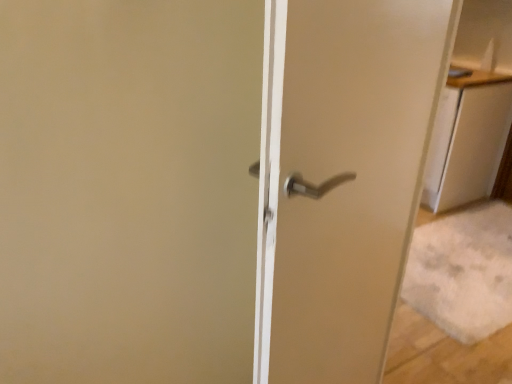
The image size is (512, 384). What do you see at coordinates (342, 173) in the screenshot? I see `satin silver handle at center` at bounding box center [342, 173].

You are a GUI agent. You are given a task and a screenshot of the screen. Output one action in this format:
    pyautogui.click(x=<x>, y=<y>)
    Task: Click on the satin silver handle at center
    The image size is (512, 384).
    Given the screenshot: What is the action you would take?
    pyautogui.click(x=342, y=173)

What do you see at coordinates (467, 139) in the screenshot?
I see `white glossy cabinet at upper right` at bounding box center [467, 139].

Find the location of a particular element. white glossy cabinet at upper right is located at coordinates click(467, 139).

Find the location of a particular element. Image resolution: width=512 pixels, height=384 pixels. satin silver handle at center is located at coordinates (342, 173).

Considering the positions of objects satin silver handle at center and white glossy cabinet at upper right in the image provided, who is more to the right, satin silver handle at center or white glossy cabinet at upper right?

From the viewer's perspective, white glossy cabinet at upper right appears more on the right side.

Does satin silver handle at center lie in front of white glossy cabinet at upper right?

Yes, the depth of satin silver handle at center is less than that of white glossy cabinet at upper right.

Which point is more forward, (382, 4) or (453, 165)?

Positioned in front is point (382, 4).

From the image's perspective, is satin silver handle at center located above white glossy cabinet at upper right?

No, from the image's perspective, satin silver handle at center is not on top of white glossy cabinet at upper right.

From a real-world perspective, is satin silver handle at center physically above white glossy cabinet at upper right?

Yes, from a real-world perspective, satin silver handle at center is on top of white glossy cabinet at upper right.

Which of these two, satin silver handle at center or white glossy cabinet at upper right, is thinner?

satin silver handle at center.

Is satin silver handle at center taller than white glossy cabinet at upper right?

Indeed, satin silver handle at center has a greater height compared to white glossy cabinet at upper right.

Based on the photo, who is bigger, satin silver handle at center or white glossy cabinet at upper right?

With larger size is satin silver handle at center.

Is satin silver handle at center not inside white glossy cabinet at upper right?

satin silver handle at center lies outside white glossy cabinet at upper right's area.

Would you say satin silver handle at center is a long distance from white glossy cabinet at upper right?

Yes, satin silver handle at center and white glossy cabinet at upper right are located far from each other.

Is satin silver handle at center oriented away from white glossy cabinet at upper right?

No, satin silver handle at center is not facing away from white glossy cabinet at upper right.

How far apart are satin silver handle at center and white glossy cabinet at upper right?

The distance of satin silver handle at center from white glossy cabinet at upper right is 6.15 feet.

Where is `cabinetry above the satin silver handle at center (from the image's perspective)`? cabinetry above the satin silver handle at center (from the image's perspective) is located at coordinates (467, 139).

Visually, is white glossy cabinet at upper right positioned to the left or to the right of satin silver handle at center?

Based on their positions, white glossy cabinet at upper right is located to the right of satin silver handle at center.

Which object is further away from the camera taking this photo, white glossy cabinet at upper right or satin silver handle at center?

white glossy cabinet at upper right is more distant.

Is point (452, 152) closer to viewer compared to point (440, 12)?

No, it is behind (440, 12).

From the image's perspective, does white glossy cabinet at upper right appear lower than satin silver handle at center?

Incorrect, from the image's perspective, white glossy cabinet at upper right is higher than satin silver handle at center.

From a real-world perspective, is white glossy cabinet at upper right physically located above or below satin silver handle at center?

white glossy cabinet at upper right is situated lower than satin silver handle at center in the real world.

Is white glossy cabinet at upper right wider or thinner than satin silver handle at center?

white glossy cabinet at upper right is wider than satin silver handle at center.

Which of these two, white glossy cabinet at upper right or satin silver handle at center, stands taller?

satin silver handle at center.

Can you confirm if white glossy cabinet at upper right is bigger than satin silver handle at center?

Incorrect, white glossy cabinet at upper right is not larger than satin silver handle at center.

Is white glossy cabinet at upper right outside of satin silver handle at center?

Indeed, white glossy cabinet at upper right is completely outside satin silver handle at center.

Are white glossy cabinet at upper right and satin silver handle at center making contact?

No, white glossy cabinet at upper right is not in contact with satin silver handle at center.

Is white glossy cabinet at upper right looking in the opposite direction of satin silver handle at center?

No.

Measure the distance from white glossy cabinet at upper right to satin silver handle at center.

The distance of white glossy cabinet at upper right from satin silver handle at center is 6.15 feet.

Find the location of `door below the white glossy cabinet at upper right (from the image's perspective)`. door below the white glossy cabinet at upper right (from the image's perspective) is located at coordinates (342, 173).

Find the location of `cabinetry above the satin silver handle at center (from the image's perspective)`. cabinetry above the satin silver handle at center (from the image's perspective) is located at coordinates (467, 139).

The image size is (512, 384). What are the coordinates of `door below the white glossy cabinet at upper right (from the image's perspective)` in the screenshot? It's located at (342, 173).